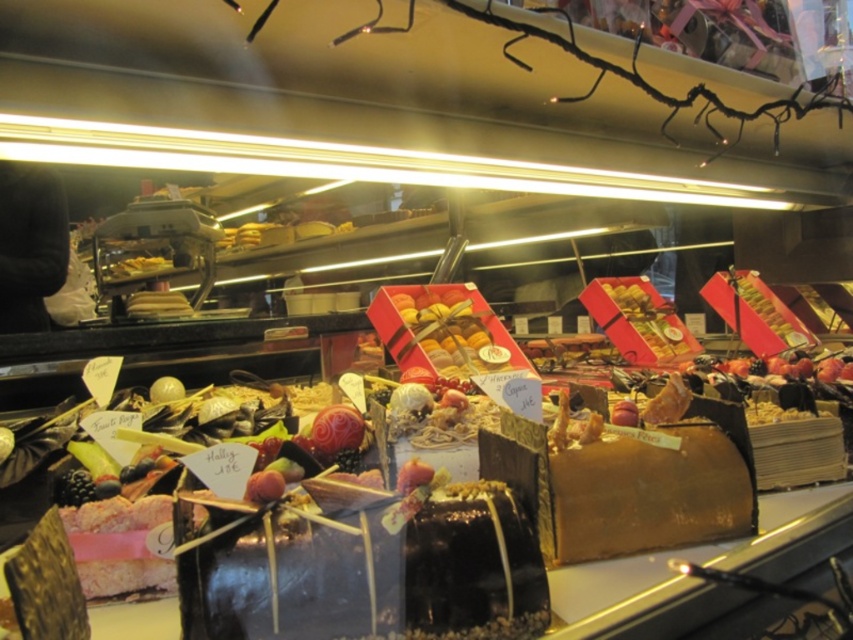
You are a customer at the bakery and want to buy both cakes. The chocolate glazed cake at center and the golden textured cake at center are both displayed in the center. Which cake is taller?

The golden textured cake at center is taller than the chocolate glazed cake at center.

You are a customer standing in front of the bakery display. You want to take a photo of both the chocolate glazed cake at center and the golden textured cake at center. Which cake should you focus on first to ensure both are in clear view?

You should focus on the chocolate glazed cake at center first since it is closer to you than the golden textured cake at center. By focusing on the closer cake, the depth of field may allow both cakes to be in clear view.